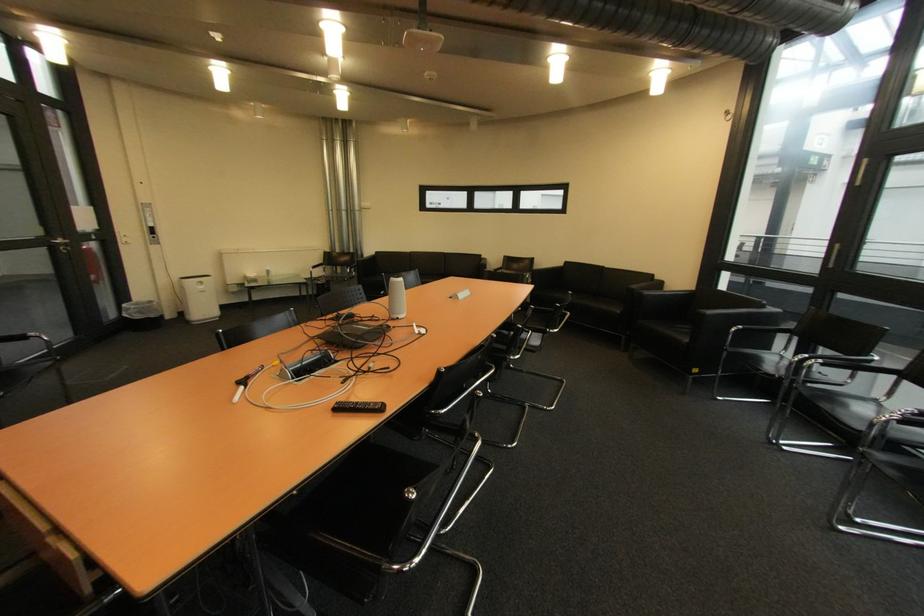
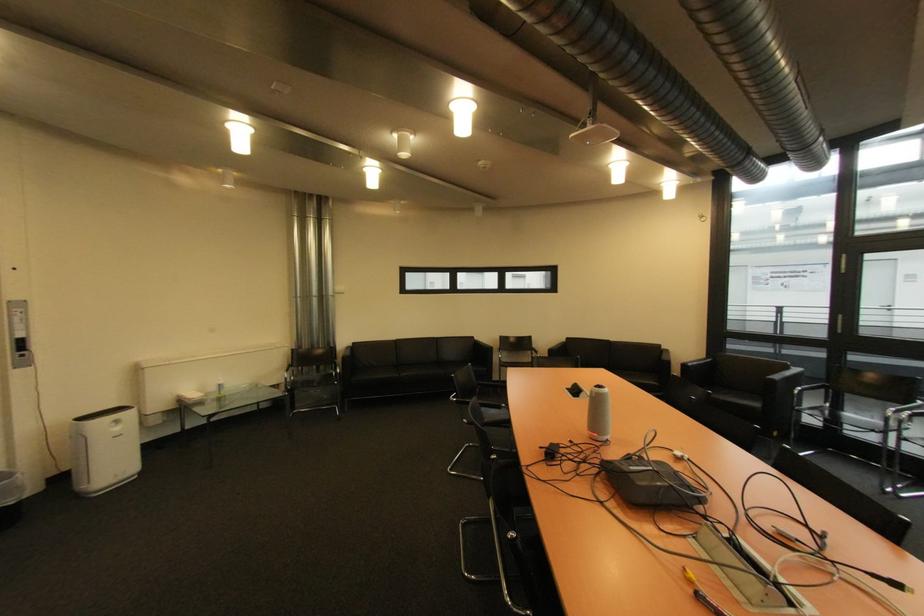
Find the pixel in the second image that matches (333,254) in the first image.

(301, 352)